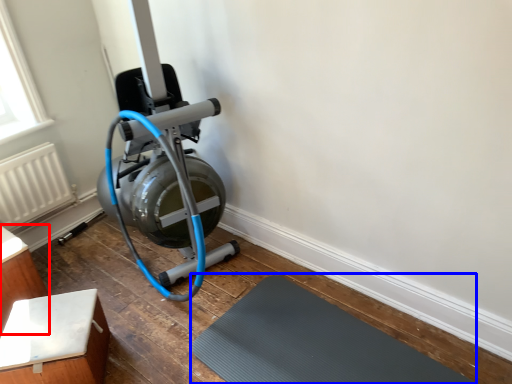
Question: Which point is further to the camera, furniture (highlighted by a red box) or bath mat (highlighted by a blue box)?

Choices:
 (A) furniture
 (B) bath mat

Answer: (A)